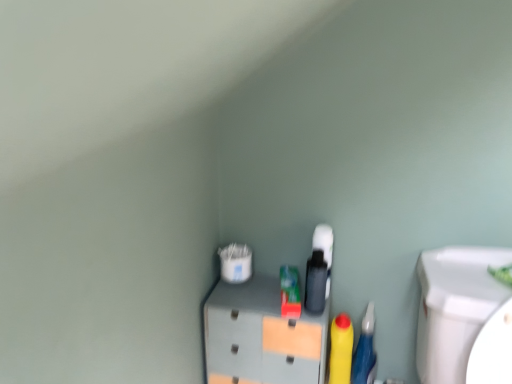
Question: Considering their positions, is rubberized blue pen at right located in front of or behind yellow matte bottle at center?

Choices:
 (A) behind
 (B) front

Answer: (B)

Question: From a real-world perspective, is rubberized blue pen at right physically located above or below yellow matte bottle at center?

Choices:
 (A) above
 (B) below

Answer: (B)

Question: Which of these objects is positioned closest to the yellow matte bottle at center?

Choices:
 (A) matte gray cabinet at center
 (B) rubberized blue pen at right

Answer: (B)

Question: Which object is positioned farthest from the matte gray cabinet at center?

Choices:
 (A) rubberized blue pen at right
 (B) yellow matte bottle at center

Answer: (A)